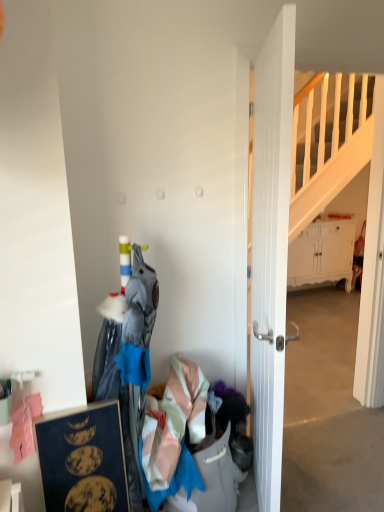
The width and height of the screenshot is (384, 512). In order to click on unoccupied region to the right of white wooden door at center in this screenshot , I will do `click(325, 476)`.